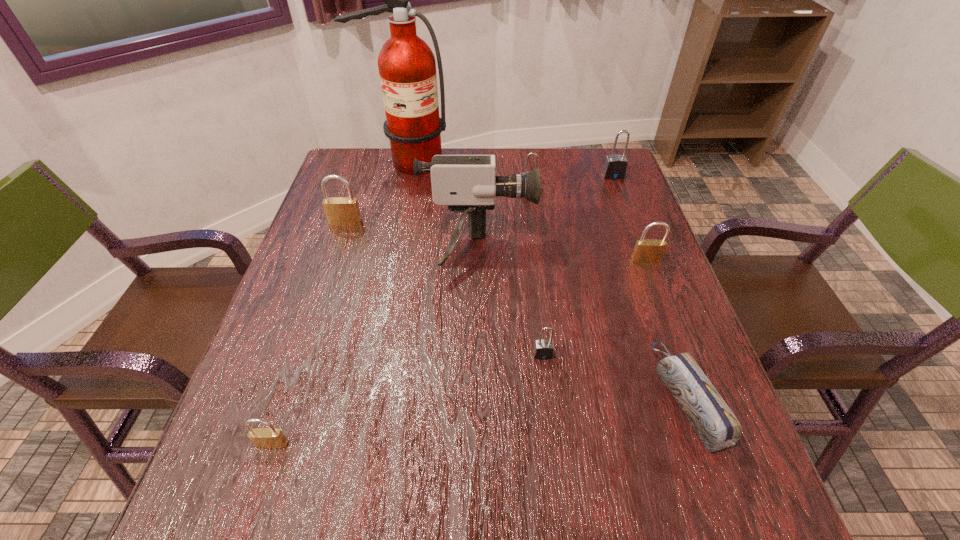
Where is `the second biggest brass padlock`? The image size is (960, 540). the second biggest brass padlock is located at coordinates (646, 250).

Find the location of a particular element. This screenshot has height=540, width=960. the smallest gray padlock is located at coordinates (543, 349).

This screenshot has height=540, width=960. What are the coordinates of `the nearest gray padlock` in the screenshot? It's located at (543, 349).

Find the location of a particular element. The image size is (960, 540). the smallest brass padlock is located at coordinates pyautogui.click(x=267, y=438).

The width and height of the screenshot is (960, 540). In order to click on the nearest padlock in this screenshot , I will do `click(267, 438)`.

Identify the location of the shortest object. This screenshot has width=960, height=540. (716, 425).

Where is `vacant space located 0.130m on the nozzle and handle of the fire extinguisher`? This screenshot has width=960, height=540. vacant space located 0.130m on the nozzle and handle of the fire extinguisher is located at coordinates (397, 203).

Locate an element on the screen. vacant space located on the recording direction of the camcorder is located at coordinates (639, 252).

Locate an element on the screen. The width and height of the screenshot is (960, 540). vacant area situated 0.050m on the shackle of the farthest padlock is located at coordinates (618, 189).

You are a GUI agent. You are given a task and a screenshot of the screen. Output one action in this format:
    pyautogui.click(x=<x>, y=<y>)
    Task: Click on the vacant space located on the front-facing side of the biggest brass padlock
    The height and width of the screenshot is (540, 960).
    Given the screenshot: What is the action you would take?
    pyautogui.click(x=339, y=244)